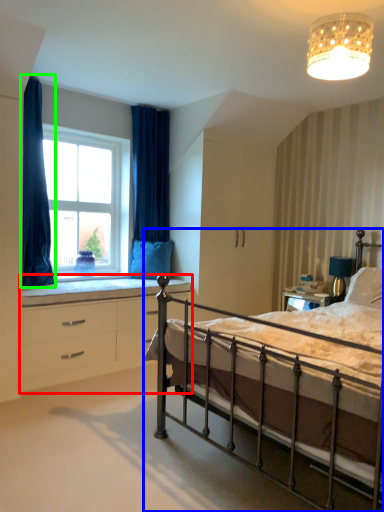
Question: Based on their relative distances, which object is nearer to chest of drawers (highlighted by a red box)? Choose from bed (highlighted by a blue box) and curtain (highlighted by a green box).

Choices:
 (A) bed
 (B) curtain

Answer: (B)